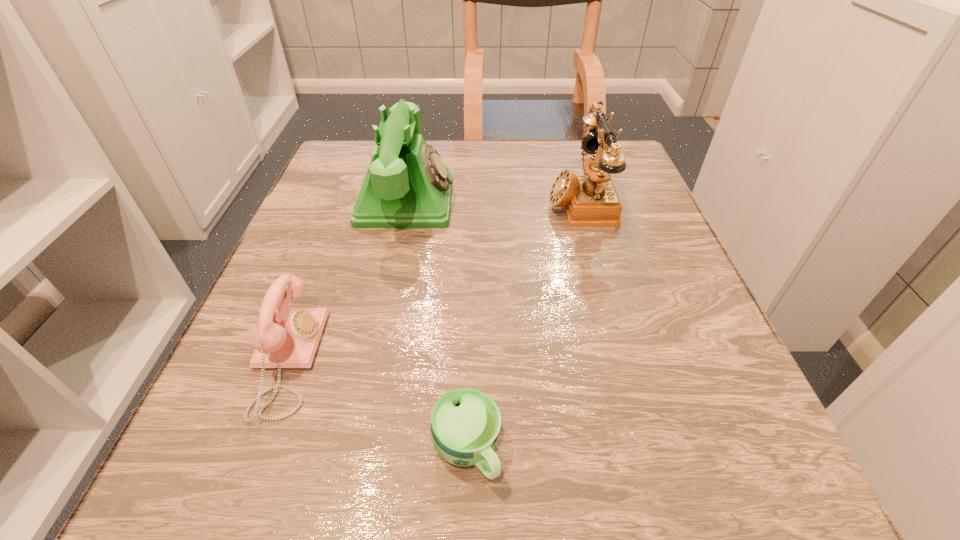
Find the location of a particular element. The image size is (960, 540). vacant space in between the shortest telephone and the rightmost telephone is located at coordinates (433, 280).

Where is `free area in between the nearest telephone and the shortest object`? The image size is (960, 540). free area in between the nearest telephone and the shortest object is located at coordinates tap(376, 404).

This screenshot has height=540, width=960. In order to click on vacant area that lies between the rightmost telephone and the cup in this screenshot , I will do `click(522, 325)`.

The width and height of the screenshot is (960, 540). I want to click on vacant space that is in between the shortest telephone and the rightmost object, so pyautogui.click(x=433, y=280).

Identify the location of vacant point located between the second shortest object and the shortest object. (376, 404).

Locate an element on the screen. Image resolution: width=960 pixels, height=540 pixels. vacant space that's between the third tallest object and the cup is located at coordinates (376, 404).

Locate which object is the closest to the shortest object. Please provide its 2D coordinates. Your answer should be formatted as a tuple, i.e. [(x, y)], where the tuple contains the x and y coordinates of a point satisfying the conditions above.

[(285, 337)]

Point out which object is positioned as the second nearest to the rightmost telephone. Please provide its 2D coordinates. Your answer should be formatted as a tuple, i.e. [(x, y)], where the tuple contains the x and y coordinates of a point satisfying the conditions above.

[(465, 423)]

Locate an element on the screen. telephone that stands as the closest to the third tallest object is located at coordinates (407, 185).

Find the location of `telephone that is the nearest to the rightmost telephone`. telephone that is the nearest to the rightmost telephone is located at coordinates (407, 185).